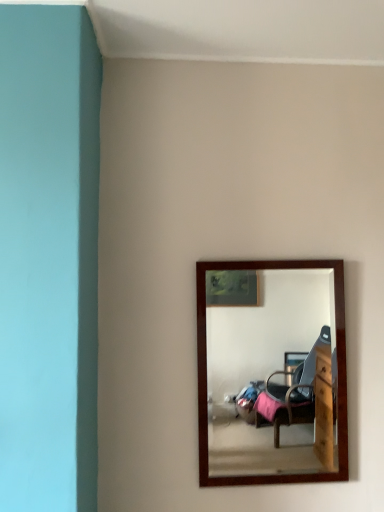
Question: Should I look upward or downward to see wooden-framed mirror at center?

Choices:
 (A) up
 (B) down

Answer: (B)